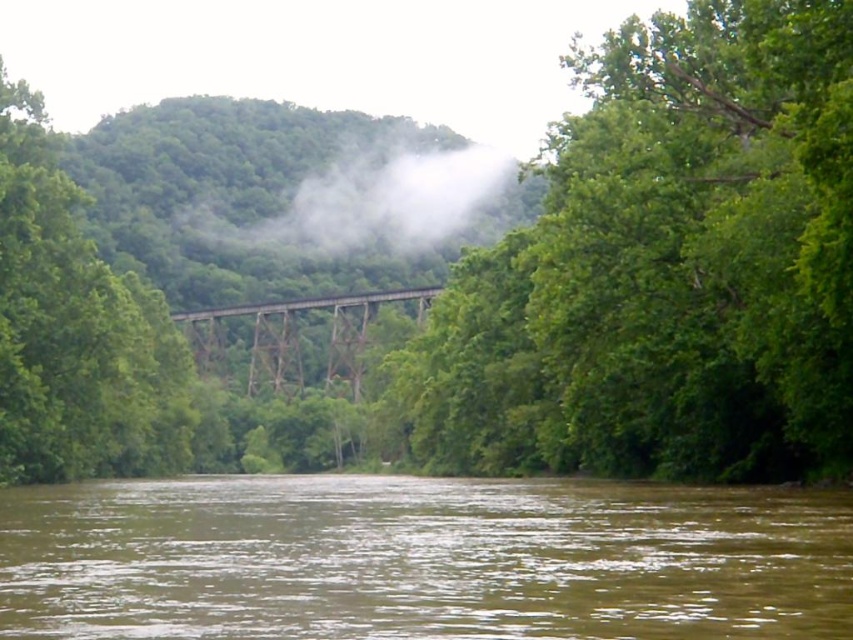
Looking at this image, does green leafy tree at upper center lie in front of brown wooden train bridge at center?

Yes, green leafy tree at upper center is closer to the viewer.

Is green leafy tree at upper center below brown wooden train bridge at center?

No, green leafy tree at upper center is not below brown wooden train bridge at center.

Measure the distance between point (596,449) and camera.

Point (596,449) is 199.74 feet away from camera.

Image resolution: width=853 pixels, height=640 pixels. Identify the location of green leafy tree at upper center. (663, 268).

At what (x,y) coordinates should I click in order to perform the action: click on white foggy mist at center. Please return your answer as a coordinate pair (x, y). This screenshot has height=640, width=853. Looking at the image, I should click on (389, 200).

Who is more distant from viewer, (397, 250) or (247, 305)?

The point (397, 250) is behind.

Locate an element on the screen. white foggy mist at center is located at coordinates (389, 200).

Can you confirm if brown muddy water at lower center is taller than brown wooden train bridge at center?

No, brown muddy water at lower center is not taller than brown wooden train bridge at center.

Is brown muddy water at lower center bigger than brown wooden train bridge at center?

Actually, brown muddy water at lower center might be smaller than brown wooden train bridge at center.

Image resolution: width=853 pixels, height=640 pixels. I want to click on brown muddy water at lower center, so click(x=422, y=560).